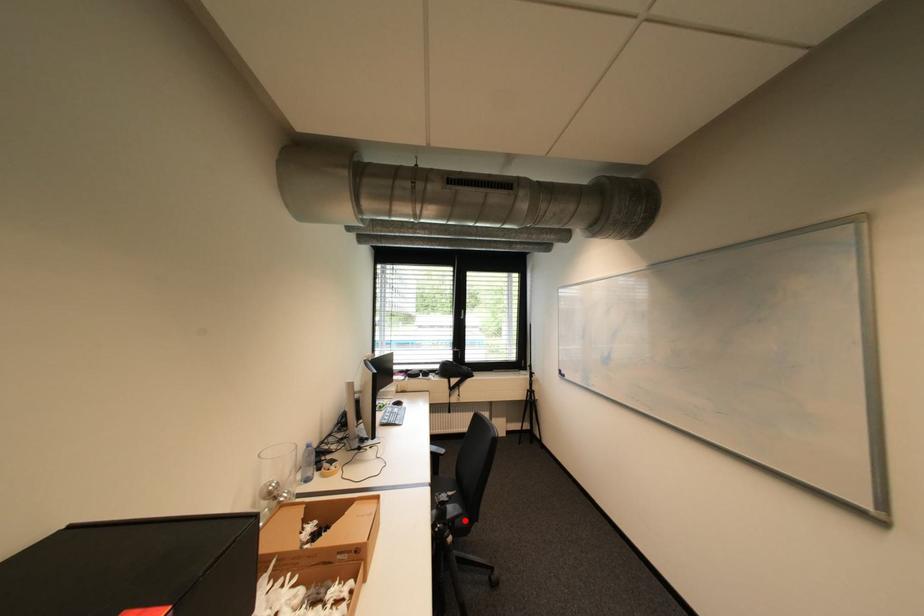
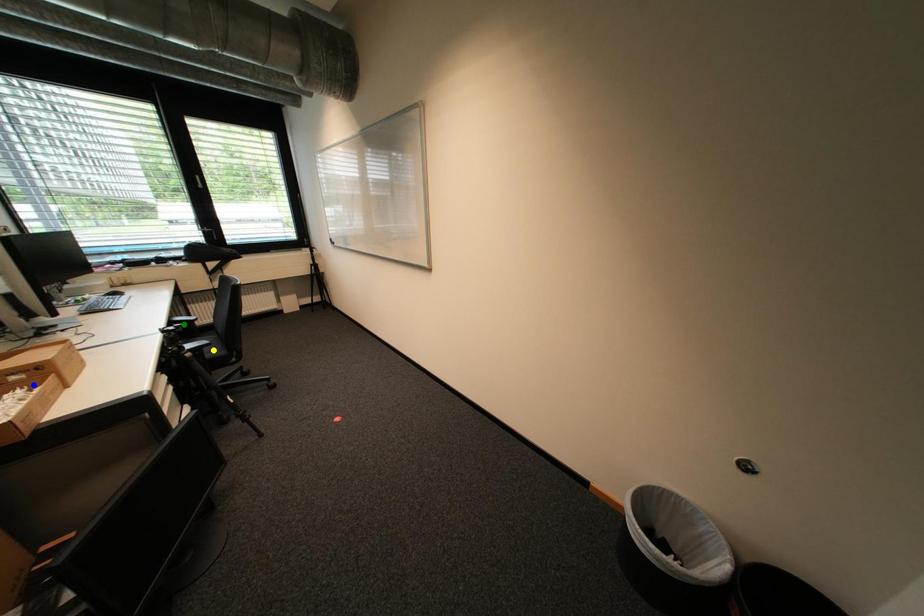
Question: I am providing you with two images of the same scene from different viewpoints. A red point is marked on the first image. You are given multiple points on the second image. Which point in image 2 represents the same 3d spot as the red point in image 1?

Choices:
 (A) green point
 (B) yellow point
 (C) blue point

Answer: (B)